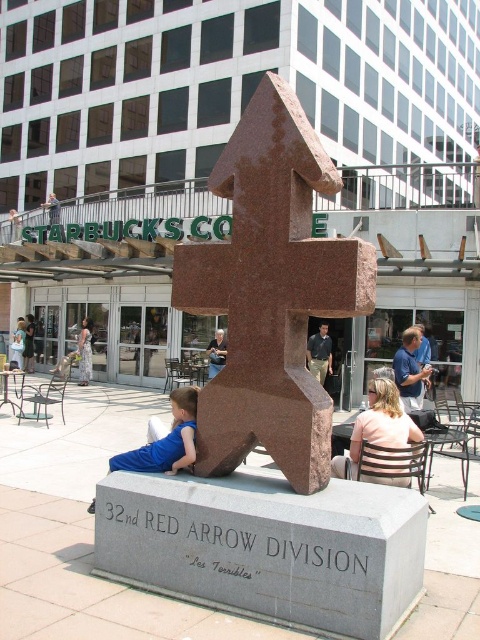
You are standing at the base of the large stone sculpture and want to walk to the Starbucks Coffee shop. You see a blue fabric shirt at lower left and blue denim jeans at center. Which direction should you walk to reach the Starbucks Coffee shop?

The blue fabric shirt at lower left and blue denim jeans at center are 9.21 meters apart from each other. Since the Starbucks Coffee shop is in the background behind the sculpture, you should walk away from the sculpture towards the building with the grid windows where the Starbucks is located.

From the picture: You are standing in front of the sculpture and want to take a photo of both the blue fabric shirt at lower left and the blue denim jeans at center. Which object should you focus on first to ensure both are in clear view?

You should focus on the blue fabric shirt at lower left first because it is closer to the viewer than the blue denim jeans at center, ensuring both are in clear focus when adjusting the camera settings.